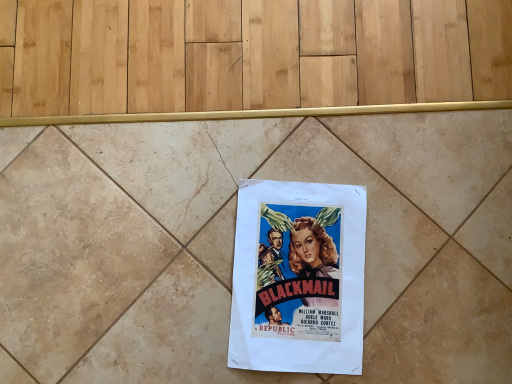
Find the location of a particular element. empty space that is ontop of matte paper poster at center is located at coordinates (300, 278).